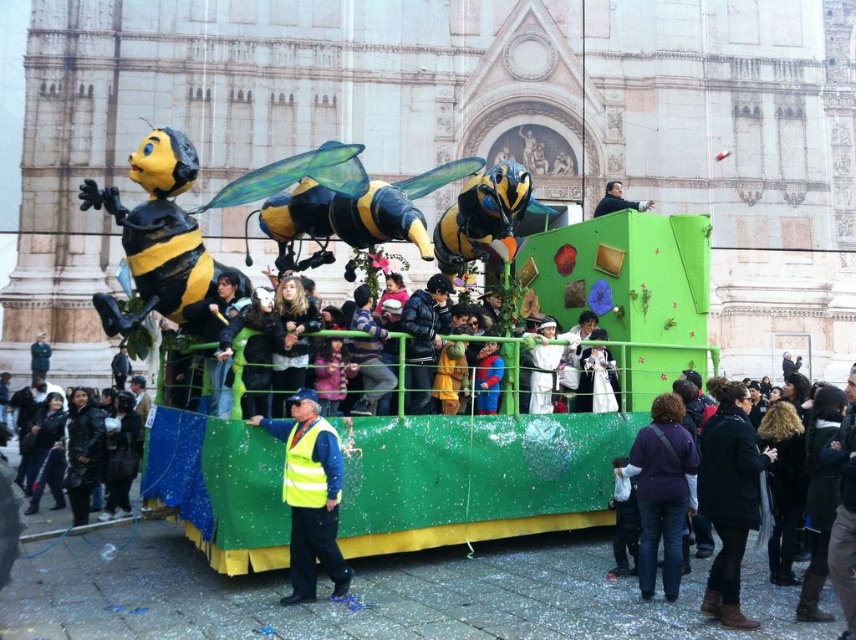
Can you confirm if matte black jacket at center is bigger than matte black jacket at upper right?

No.

Is point (217, 316) closer to camera compared to point (626, 200)?

Yes.

Is point (260, 332) positioned before point (625, 209)?

Yes, it is in front of point (625, 209).

This screenshot has height=640, width=856. In order to click on matte black jacket at center in this screenshot , I will do `click(248, 317)`.

Does matte black jacket at center appear on the left side of black leather jacket at lower left?

Incorrect, matte black jacket at center is not on the left side of black leather jacket at lower left.

Who is more distant from viewer, (212, 298) or (91, 451)?

Positioned behind is point (91, 451).

This screenshot has height=640, width=856. What are the coordinates of `matte black jacket at center` in the screenshot? It's located at (248, 317).

Does point (642, 204) come in front of point (39, 371)?

Yes.

Does matte black jacket at upper right have a lesser width compared to dark blue jacket at center?

Incorrect, matte black jacket at upper right's width is not less than dark blue jacket at center's.

Does point (599, 205) lie in front of point (49, 353)?

Yes, it is in front of point (49, 353).

This screenshot has width=856, height=640. I want to click on matte black jacket at upper right, so click(x=617, y=200).